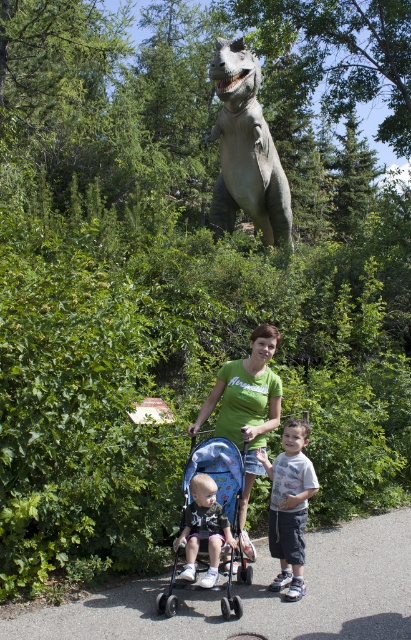
Which is more to the right, gray asphalt path at center or light blue t-shirt at center?

light blue t-shirt at center is more to the right.

Is gray asphalt path at center positioned behind light blue t-shirt at center?

No, gray asphalt path at center is in front of light blue t-shirt at center.

Is point (46, 620) in front of point (281, 556)?

Yes, it is.

You are a GUI agent. You are given a task and a screenshot of the screen. Output one action in this format:
    pyautogui.click(x=<x>, y=<y>)
    Task: Click on the gray asphalt path at center
    The width and height of the screenshot is (411, 640).
    Given the screenshot: What is the action you would take?
    pyautogui.click(x=260, y=596)

Can you confirm if gray textured statue at upper center is smaller than green matte shirt at center?

Indeed, gray textured statue at upper center has a smaller size compared to green matte shirt at center.

Measure the distance from gray textured statue at upper center to green matte shirt at center.

41.45 feet

Identify the location of gray textured statue at upper center. This screenshot has width=411, height=640. (246, 148).

Measure the distance between point (267, 592) and camera.

A distance of 4.51 meters exists between point (267, 592) and camera.

Can you confirm if gray asphalt path at center is positioned to the right of green matte shirt at center?

Yes, gray asphalt path at center is to the right of green matte shirt at center.

Identify the location of gray asphalt path at center. (260, 596).